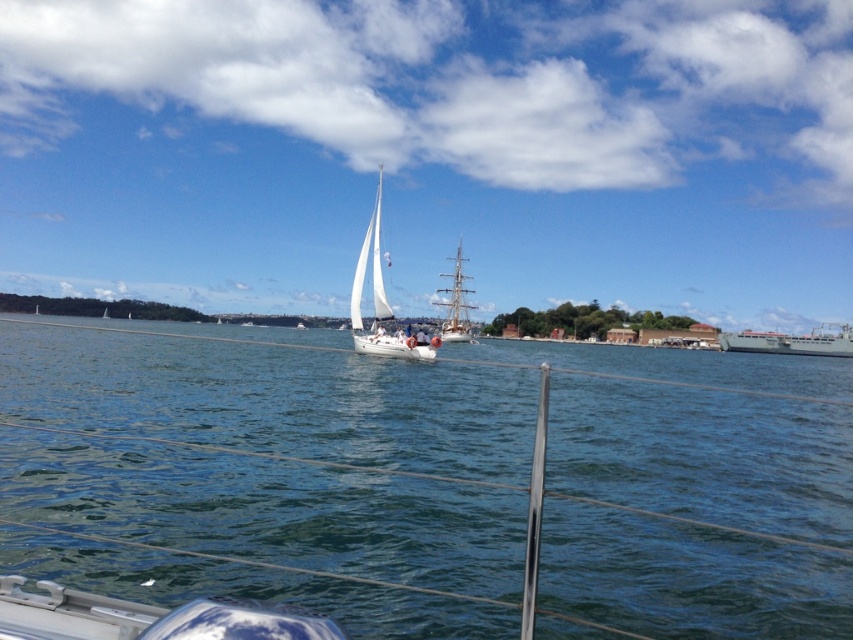
Question: Does clear blue water at center lie behind gray metallic ship at right?

Choices:
 (A) yes
 (B) no

Answer: (B)

Question: Is clear blue water at center to the right of gray metallic ship at right from the viewer's perspective?

Choices:
 (A) yes
 (B) no

Answer: (B)

Question: Can you confirm if clear blue water at center is smaller than white matte sailboat at center?

Choices:
 (A) yes
 (B) no

Answer: (B)

Question: Which point is farther from the camera taking this photo?

Choices:
 (A) (795, 336)
 (B) (498, 428)
 (C) (459, 308)
 (D) (355, 301)

Answer: (C)

Question: Which of the following is the closest to the observer?

Choices:
 (A) clear blue water at center
 (B) white wooden sailboat at center
 (C) white matte sailboat at center
 (D) gray metallic ship at right

Answer: (A)

Question: Which point is farther from the camera taking this photo?

Choices:
 (A) (802, 348)
 (B) (758, 378)

Answer: (A)